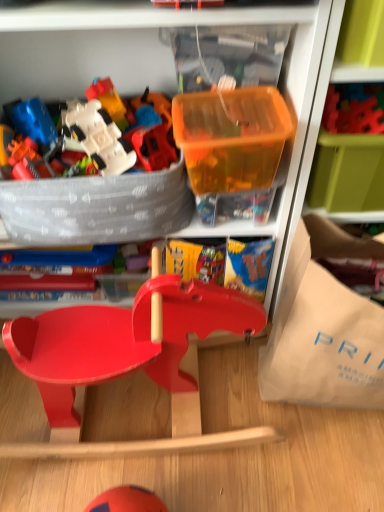
The height and width of the screenshot is (512, 384). Describe the element at coordinates (322, 339) in the screenshot. I see `beige paper bag at right` at that location.

This screenshot has width=384, height=512. Identify the location of white plastic spaceship at upper left, acting as the 1th toy starting from the bottom. (93, 135).

I want to click on translucent orange plastic container at upper center, so click(231, 137).

Measure the distance between smooth plastic toy at center, the 2th toy when ordered from bottom to top, and camera.

smooth plastic toy at center, the 2th toy when ordered from bottom to top, is 23.50 inches away from camera.

Where is `smooth red wooden baby carriage at center`? smooth red wooden baby carriage at center is located at coordinates (128, 359).

Describe the element at coordinates (128, 359) in the screenshot. The image size is (384, 512). I see `smooth red wooden baby carriage at center` at that location.

Find the location of `beige paper bag at right`. beige paper bag at right is located at coordinates (322, 339).

Considering the sizes of objects smooth plastic toy at center, acting as the 1th toy starting from the top, and white plastic spaceship at upper left, acting as the 1th toy starting from the bottom, in the image provided, who is smaller, smooth plastic toy at center, acting as the 1th toy starting from the top, or white plastic spaceship at upper left, acting as the 1th toy starting from the bottom,?

With smaller size is white plastic spaceship at upper left, acting as the 1th toy starting from the bottom.

Which is more to the left, smooth plastic toy at center, acting as the 1th toy starting from the top, or white plastic spaceship at upper left, the 1th toy from the left?

white plastic spaceship at upper left, the 1th toy from the left.

Is smooth plastic toy at center, acting as the 1th toy starting from the top, wider or thinner than white plastic spaceship at upper left, positioned as the 2th toy in right-to-left order?

In the image, smooth plastic toy at center, acting as the 1th toy starting from the top, appears to be wider than white plastic spaceship at upper left, positioned as the 2th toy in right-to-left order.

How distant is smooth plastic toy at center, which is the 1th toy from right to left, from white plastic spaceship at upper left, the 1th toy from the left?

The distance of smooth plastic toy at center, which is the 1th toy from right to left, from white plastic spaceship at upper left, the 1th toy from the left, is 32.33 centimeters.

Can you confirm if translucent plastic container at upper right is smaller than smooth plastic toy at center, the 2th toy viewed from the left?

Actually, translucent plastic container at upper right might be larger than smooth plastic toy at center, the 2th toy viewed from the left.

Considering their positions, is translucent plastic container at upper right located in front of or behind smooth plastic toy at center, acting as the 1th toy starting from the top?

translucent plastic container at upper right is behind smooth plastic toy at center, acting as the 1th toy starting from the top.

Is translucent plastic container at upper right turned away from smooth plastic toy at center, which is the 1th toy from right to left?

No, smooth plastic toy at center, which is the 1th toy from right to left, is not at the back of translucent plastic container at upper right.

From the image's perspective, which one is positioned lower, translucent plastic container at upper right or smooth plastic toy at center, the 2th toy viewed from the left?

From the image's view, translucent plastic container at upper right is below.

Choose the correct answer: Is translucent plastic container at upper right inside beige paper bag at right or outside it?

translucent plastic container at upper right is spatially situated outside beige paper bag at right.

Locate an element on the screen. shelf above the beige paper bag at right (from the image's perspective) is located at coordinates (350, 149).

Which point is more distant from viewer, (379, 201) or (375, 319)?

The point (379, 201) is farther.

Is translucent plastic container at upper right to the left of beige paper bag at right from the viewer's perspective?

No, translucent plastic container at upper right is not to the left of beige paper bag at right.

Considering the relative sizes of smooth red wooden baby carriage at center and white plastic spaceship at upper left, acting as the 1th toy starting from the bottom, in the image provided, is smooth red wooden baby carriage at center thinner than white plastic spaceship at upper left, acting as the 1th toy starting from the bottom,?

No, smooth red wooden baby carriage at center is not thinner than white plastic spaceship at upper left, acting as the 1th toy starting from the bottom.

From a real-world perspective, is smooth red wooden baby carriage at center beneath white plastic spaceship at upper left, the 1th toy from the left?

Indeed, from a real-world perspective, smooth red wooden baby carriage at center is positioned beneath white plastic spaceship at upper left, the 1th toy from the left.

From the image's perspective, is smooth red wooden baby carriage at center above white plastic spaceship at upper left, acting as the 1th toy starting from the bottom?

No, from the image's perspective, smooth red wooden baby carriage at center is not above white plastic spaceship at upper left, acting as the 1th toy starting from the bottom.

Can we say translucent orange plastic container at upper center lies outside smooth red wooden baby carriage at center?

translucent orange plastic container at upper center lies outside smooth red wooden baby carriage at center's area.

Is translucent orange plastic container at upper center wider or thinner than smooth red wooden baby carriage at center?

Clearly, translucent orange plastic container at upper center has less width compared to smooth red wooden baby carriage at center.

Is translucent orange plastic container at upper center in front of or behind smooth red wooden baby carriage at center in the image?

Visually, translucent orange plastic container at upper center is located behind smooth red wooden baby carriage at center.

From the picture: From a real-world perspective, between translucent orange plastic container at upper center and smooth red wooden baby carriage at center, who is vertically higher?

From a 3D spatial view, translucent orange plastic container at upper center is above.

Which is behind, smooth red wooden baby carriage at center or smooth plastic toy at center, the 2th toy viewed from the left?

smooth red wooden baby carriage at center.

From a real-world perspective, which toy is the 2nd one above the smooth red wooden baby carriage at center? Please provide its 2D coordinates.

[(188, 3)]

From a real-world perspective, between smooth red wooden baby carriage at center and smooth plastic toy at center, which is the 1th toy from right to left, who is vertically higher?

smooth plastic toy at center, which is the 1th toy from right to left, from a real-world perspective.

Is smooth red wooden baby carriage at center thinner than smooth plastic toy at center, the 2th toy viewed from the left?

In fact, smooth red wooden baby carriage at center might be wider than smooth plastic toy at center, the 2th toy viewed from the left.

At what (x,y) coordinates should I click in order to perform the action: click on storage box that appears behind the white plastic spaceship at upper left, positioned as the 2th toy in right-to-left order. Please return your answer as a coordinate pair (x, y). Looking at the image, I should click on (231, 137).

Which is in front, point (27, 128) or point (196, 166)?

Point (196, 166)

Looking at this image, from the image's perspective, which is below, white plastic spaceship at upper left, positioned as the 2th toy in right-to-left order, or translucent orange plastic container at upper center?

translucent orange plastic container at upper center.

From a real-world perspective, which object stands above the other?

white plastic spaceship at upper left, the 1th toy from the left, is physically above.

Locate an element on the screen. Image resolution: width=384 pixels, height=512 pixels. toy above the white plastic spaceship at upper left, acting as the 1th toy starting from the bottom (from a real-world perspective) is located at coordinates (188, 3).

In the image, there is a smooth plastic toy at center, the 2th toy when ordered from bottom to top. Find the location of `shelf below it (from a real-world perspective)`. shelf below it (from a real-world perspective) is located at coordinates (350, 149).

Estimate the real-world distances between objects in this image. Which object is closer to smooth plastic toy at center, the 2th toy viewed from the left, translucent orange plastic container at upper center or white plastic spaceship at upper left, positioned as the 2th toy in right-to-left order?

translucent orange plastic container at upper center is positioned closer to the anchor smooth plastic toy at center, the 2th toy viewed from the left.

In the scene shown: Which object lies nearer to the anchor point translucent plastic container at upper right, smooth plastic toy at center, the 2th toy when ordered from bottom to top, or beige paper bag at right?

beige paper bag at right.

When comparing their distances from beige paper bag at right, does translucent plastic container at upper right or white plastic spaceship at upper left, the 1th toy from the left, seem further?

white plastic spaceship at upper left, the 1th toy from the left, is positioned further to the anchor beige paper bag at right.

Looking at the image, which one is located further to white plastic spaceship at upper left, the 1th toy from the left, smooth red wooden baby carriage at center or translucent plastic container at upper right?

Among the two, translucent plastic container at upper right is located further to white plastic spaceship at upper left, the 1th toy from the left.

Looking at the image, which one is located closer to beige paper bag at right, smooth red wooden baby carriage at center or white plastic spaceship at upper left, acting as the 1th toy starting from the bottom?

Among the two, smooth red wooden baby carriage at center is located nearer to beige paper bag at right.

From the image, which object appears to be farther from translucent plastic container at upper right, beige paper bag at right or smooth red wooden baby carriage at center?

Based on the image, smooth red wooden baby carriage at center appears to be further to translucent plastic container at upper right.

Based on their spatial positions, is translucent orange plastic container at upper center or smooth plastic toy at center, acting as the 1th toy starting from the top, closer to translucent plastic container at upper right?

Among the two, translucent orange plastic container at upper center is located nearer to translucent plastic container at upper right.

From the image, which object appears to be nearer to smooth red wooden baby carriage at center, smooth plastic toy at center, the 2th toy when ordered from bottom to top, or white plastic spaceship at upper left, positioned as the 2th toy in right-to-left order?

Based on the image, white plastic spaceship at upper left, positioned as the 2th toy in right-to-left order, appears to be nearer to smooth red wooden baby carriage at center.

At what (x,y) coordinates should I click in order to perform the action: click on paper bag between white plastic spaceship at upper left, the 2th toy when ordered from top to bottom, and translucent plastic container at upper right, in the horizontal direction. Please return your answer as a coordinate pair (x, y). Looking at the image, I should click on (x=322, y=339).

This screenshot has width=384, height=512. Identify the location of storage box located between smooth red wooden baby carriage at center and translucent plastic container at upper right in the left-right direction. (231, 137).

You are a GUI agent. You are given a task and a screenshot of the screen. Output one action in this format:
    pyautogui.click(x=<x>, y=<y>)
    Task: Click on the storage box located between white plastic spaceship at upper left, acting as the 1th toy starting from the bottom, and translucent plastic container at upper right in the left-right direction
    
    Given the screenshot: What is the action you would take?
    pyautogui.click(x=231, y=137)

Locate an element on the screen. shelf between smooth plastic toy at center, the 2th toy viewed from the left, and beige paper bag at right from top to bottom is located at coordinates (350, 149).